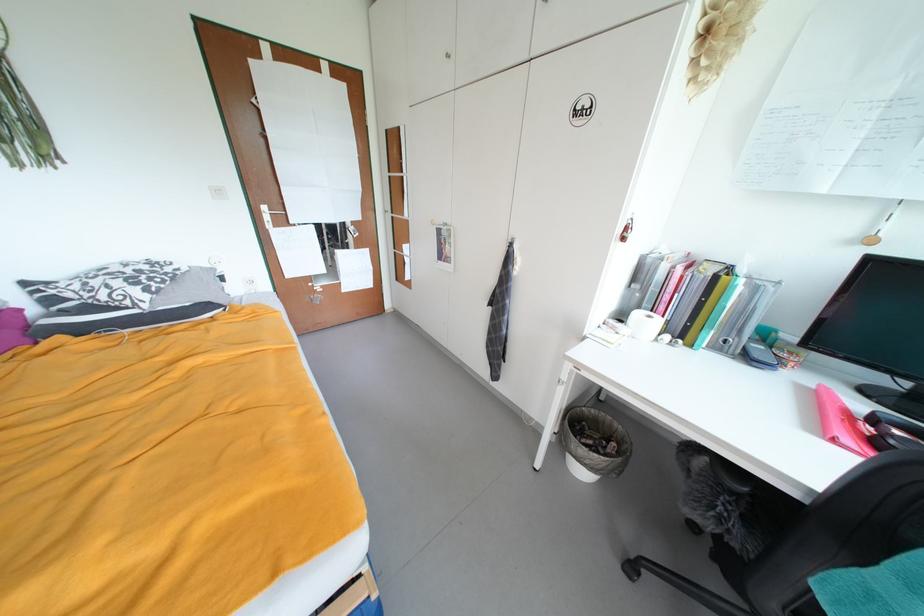
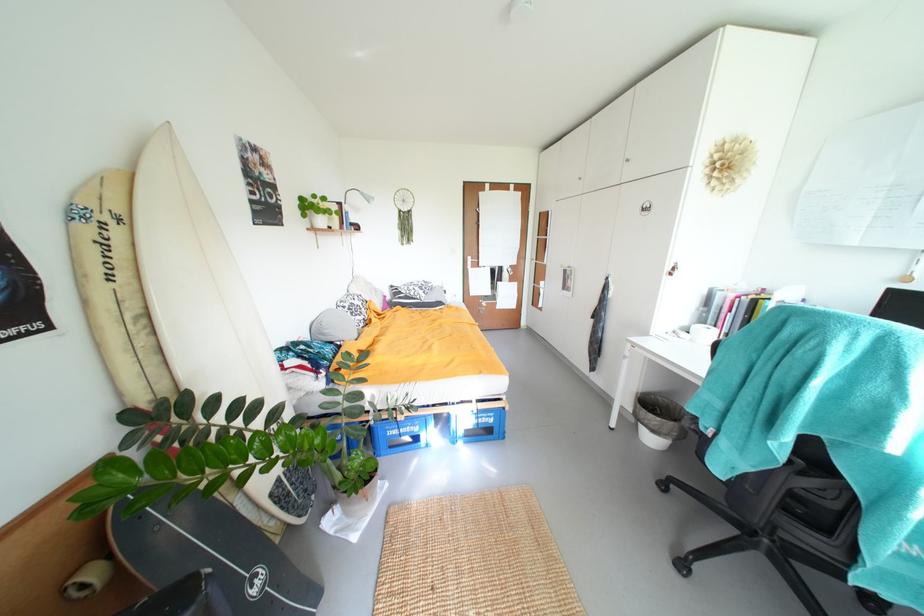
Locate, in the second image, the point that corresponds to point 284,227 in the first image.

(480, 268)